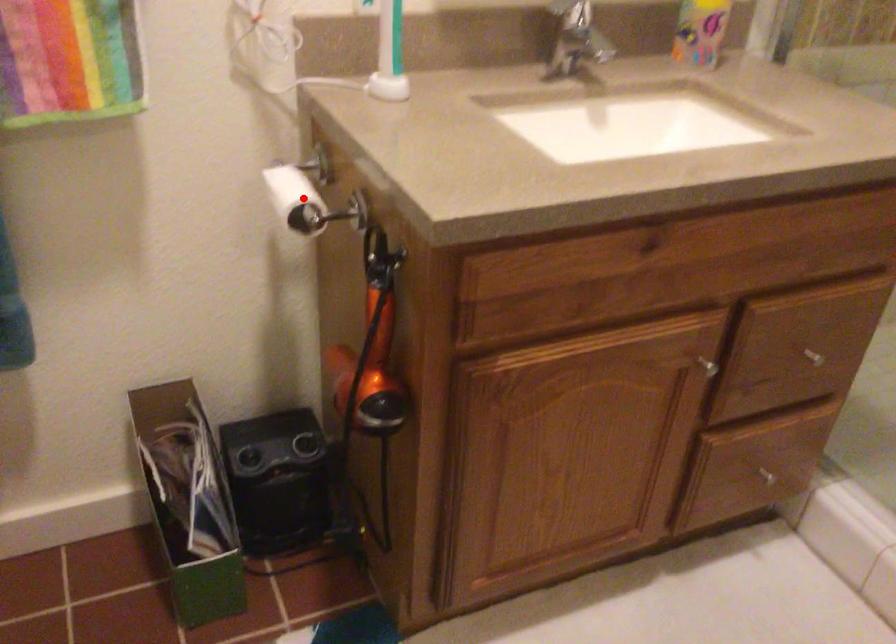
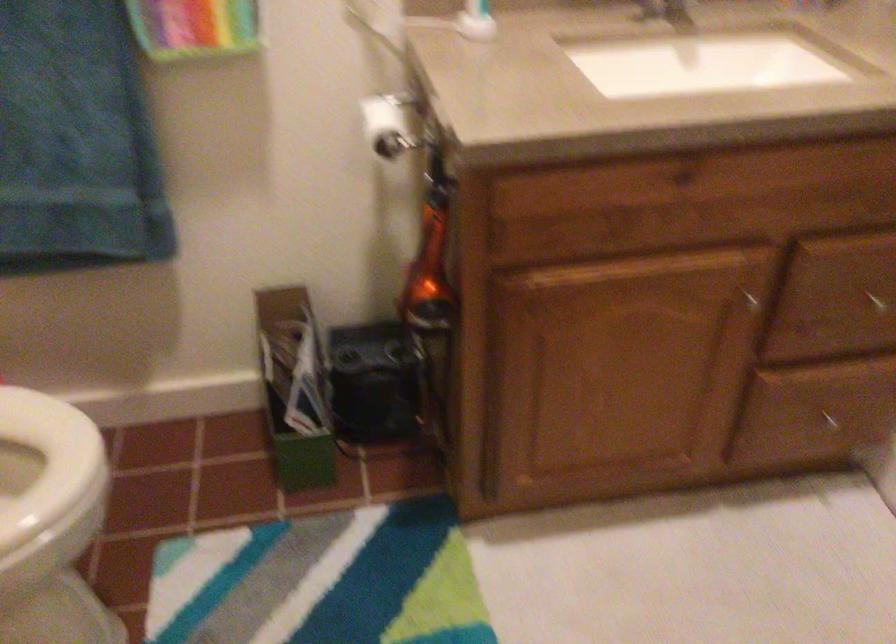
The point at the highlighted location is marked in the first image. Where is the corresponding point in the second image?

(388, 125)